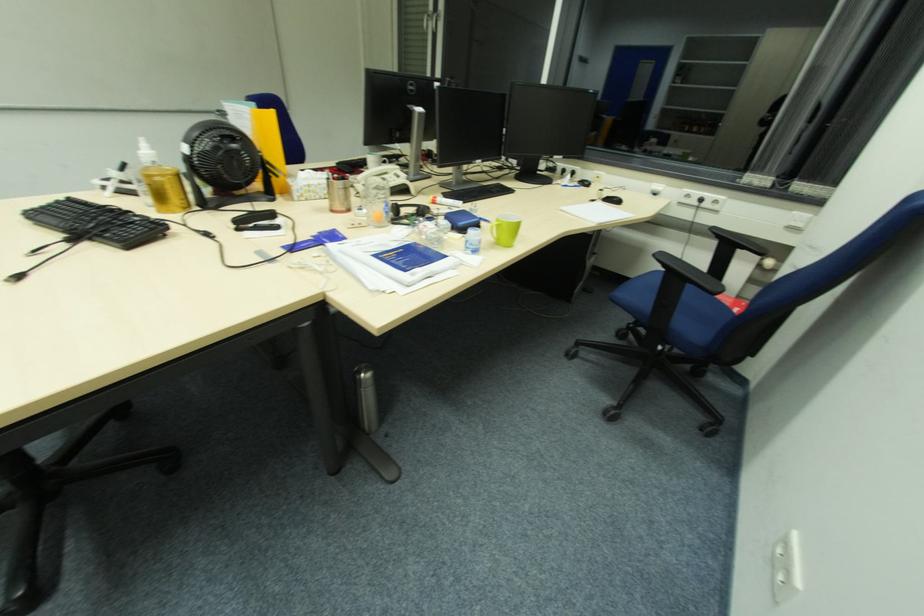
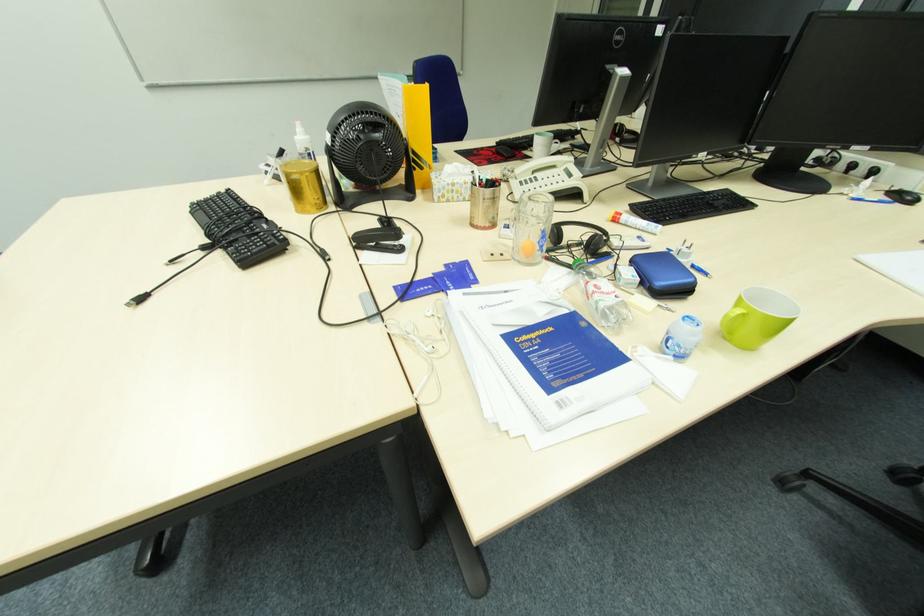
Question: The first image is from the beginning of the video and the second image is from the end. How did the camera likely rotate when shooting the video?

Choices:
 (A) Left
 (B) Right
 (C) Up
 (D) Down

Answer: (A)